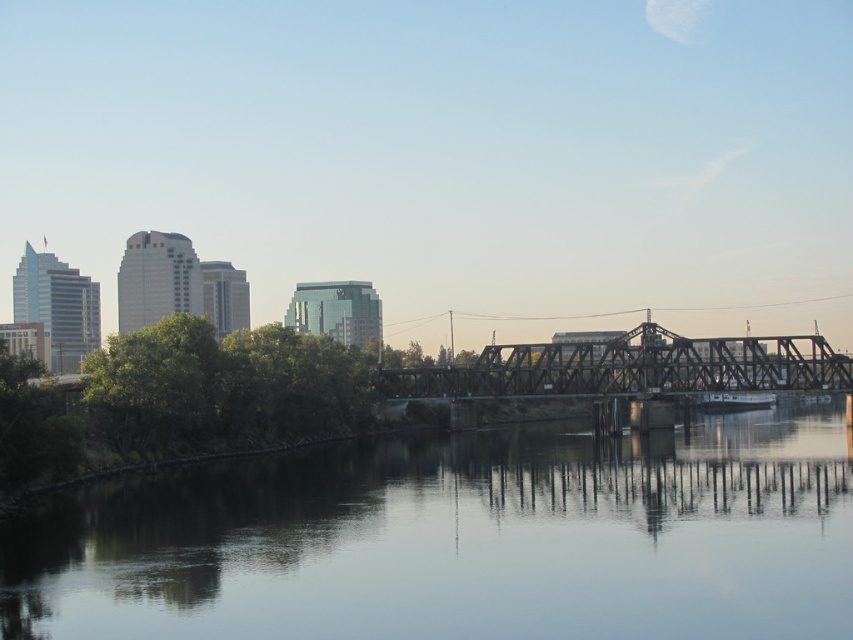
Between smooth water at center and black steel bridge at center, which one has more height?

black steel bridge at center is taller.

Who is more forward, (780,580) or (630,352)?

Point (780,580) is in front.

Find the location of `smooth water at center`. smooth water at center is located at coordinates (457, 540).